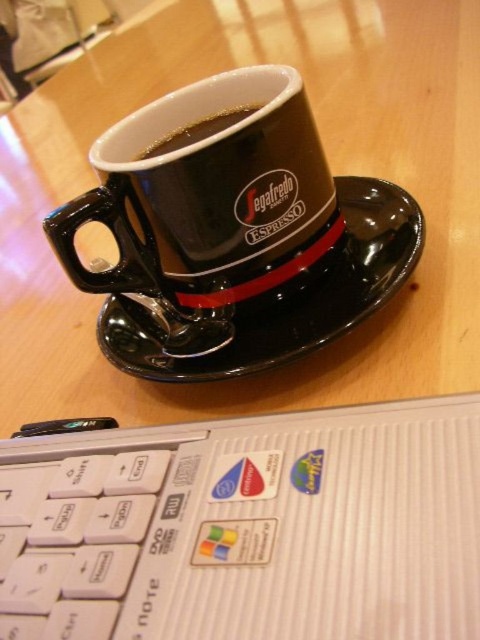
Who is more forward, (261,163) or (212,116)?

Point (261,163)

Who is positioned more to the left, glossy ceramic mug at center or black glossy cup at upper center?

black glossy cup at upper center is more to the left.

Measure the distance between point [156,252] and camera.

Point [156,252] and camera are 18.18 inches apart.

Locate an element on the screen. glossy ceramic mug at center is located at coordinates (206, 202).

Looking at this image, which of these two, black glossy saucer at center or black glossy cup at upper center, stands shorter?

black glossy cup at upper center

Between point (311, 266) and point (163, 150), which one is positioned in front?

Point (311, 266) is in front.

Between point (148, 342) and point (201, 124), which one is positioned in front?

Positioned in front is point (148, 342).

Identify the location of black glossy saucer at center. This screenshot has height=640, width=480. (286, 296).

Which is above, wooden table at center or black glossy saucer at center?

Positioned higher is wooden table at center.

Which is behind, point (10, 195) or point (352, 243)?

The point (10, 195) is behind.

This screenshot has height=640, width=480. What are the coordinates of `wooden table at center` in the screenshot? It's located at (332, 168).